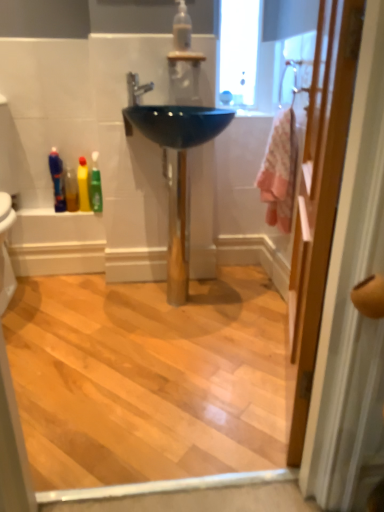
Question: Considering the relative positions of silver metallic faucet at center and matte white shower at upper right in the image provided, is silver metallic faucet at center behind matte white shower at upper right?

Choices:
 (A) yes
 (B) no

Answer: (A)

Question: Is silver metallic faucet at center taller than matte white shower at upper right?

Choices:
 (A) yes
 (B) no

Answer: (B)

Question: Is silver metallic faucet at center bigger than matte white shower at upper right?

Choices:
 (A) yes
 (B) no

Answer: (B)

Question: Does silver metallic faucet at center have a lesser width compared to matte white shower at upper right?

Choices:
 (A) yes
 (B) no

Answer: (B)

Question: From the image's perspective, would you say silver metallic faucet at center is shown under matte white shower at upper right?

Choices:
 (A) no
 (B) yes

Answer: (B)

Question: Considering the relative positions of silver metallic faucet at center and matte white shower at upper right in the image provided, is silver metallic faucet at center to the right of matte white shower at upper right from the viewer's perspective?

Choices:
 (A) no
 (B) yes

Answer: (A)

Question: Is translucent plastic mouthwash at left, acting as the second mouthwash starting from the front, with pink fabric at right?

Choices:
 (A) no
 (B) yes

Answer: (A)

Question: Is translucent plastic mouthwash at left, the first mouthwash positioned from the back, outside of pink fabric at right?

Choices:
 (A) no
 (B) yes

Answer: (B)

Question: Is the depth of translucent plastic mouthwash at left, the first mouthwash positioned from the back, greater than that of pink fabric at right?

Choices:
 (A) no
 (B) yes

Answer: (B)

Question: Is translucent plastic mouthwash at left, which is counted as the second mouthwash, starting from the top, to the right of pink fabric at right from the viewer's perspective?

Choices:
 (A) no
 (B) yes

Answer: (A)

Question: Is translucent plastic mouthwash at left, which is counted as the second mouthwash, starting from the top, facing away from pink fabric at right?

Choices:
 (A) no
 (B) yes

Answer: (A)

Question: Is translucent plastic mouthwash at left, which is the second mouthwash in right-to-left order, oriented towards pink fabric at right?

Choices:
 (A) yes
 (B) no

Answer: (B)

Question: Could you tell me if glossy ceramic sink at center is turned towards pink fabric at right?

Choices:
 (A) yes
 (B) no

Answer: (B)